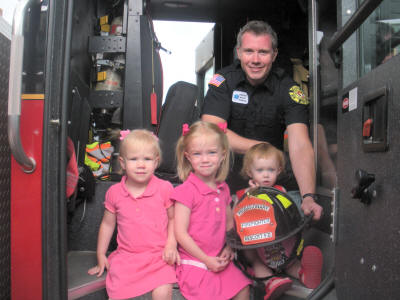
Locate where you'd grab onto the door in the image. Your answer should be formatted as a list of tuples, i.e. [(x1, y1), (x2, y2), ...], where each tuple contains the x and y coordinates of a point satisfying the conditions above.

[(354, 22)]